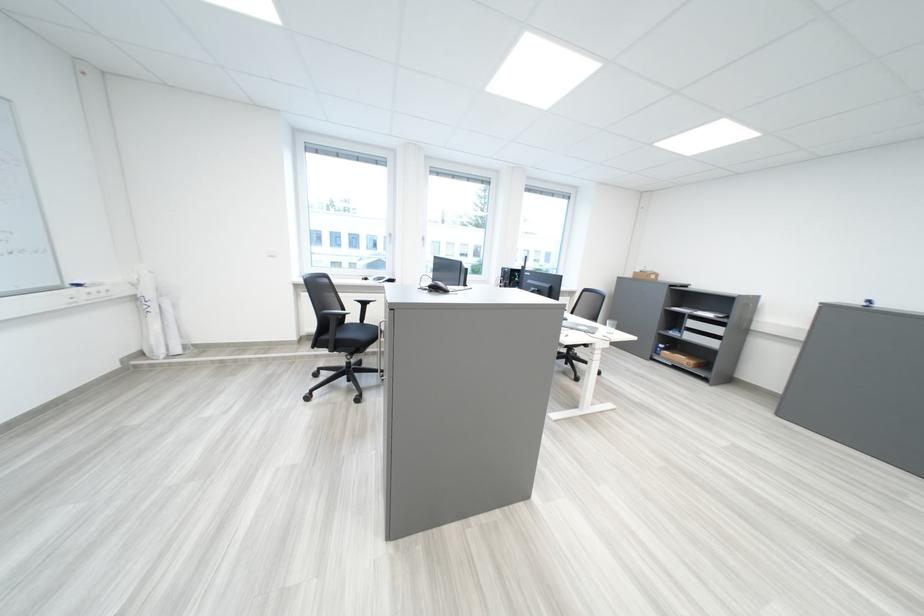
Locate an element on the screen. whiteboard marker is located at coordinates (84, 282).